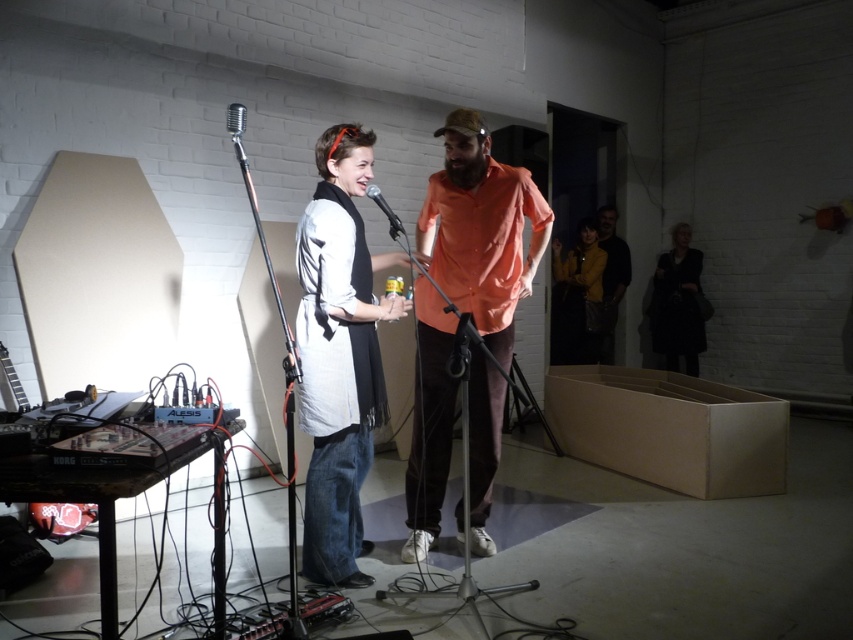
Can you confirm if yellow-orange shirt at center is positioned to the left of silver metallic microphone at upper center?

In fact, yellow-orange shirt at center is to the right of silver metallic microphone at upper center.

Between point (614, 278) and point (241, 124), which one is positioned in front?

Point (241, 124) is more forward.

What do you see at coordinates (611, 278) in the screenshot?
I see `yellow-orange shirt at center` at bounding box center [611, 278].

I want to click on yellow-orange shirt at center, so click(x=611, y=278).

Who is more forward, (604, 253) or (614, 260)?

Positioned in front is point (604, 253).

Does yellow leather jacket at center appear on the left side of yellow-orange shirt at center?

Indeed, yellow leather jacket at center is positioned on the left side of yellow-orange shirt at center.

Describe the element at coordinates (577, 298) in the screenshot. I see `yellow leather jacket at center` at that location.

This screenshot has width=853, height=640. Find the location of `yellow leather jacket at center`. yellow leather jacket at center is located at coordinates (577, 298).

Which of these two, white cotton shirt at center or metallic silver microphone at center, stands taller?

white cotton shirt at center

Can you confirm if white cotton shirt at center is taller than metallic silver microphone at center?

Yes, white cotton shirt at center is taller than metallic silver microphone at center.

Who is more forward, (325, 218) or (389, 228)?

Point (325, 218) is in front.

This screenshot has height=640, width=853. What are the coordinates of `white cotton shirt at center` in the screenshot? It's located at (339, 355).